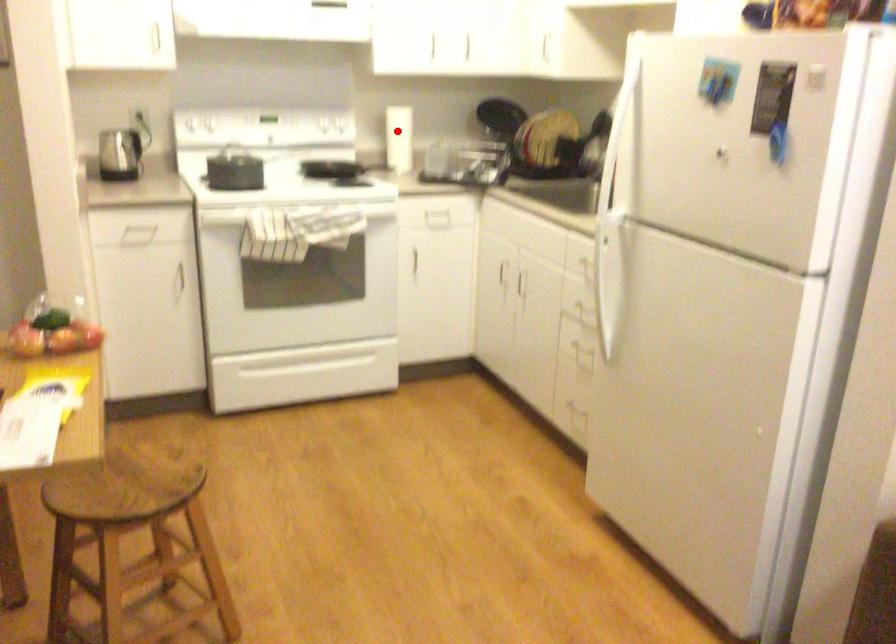
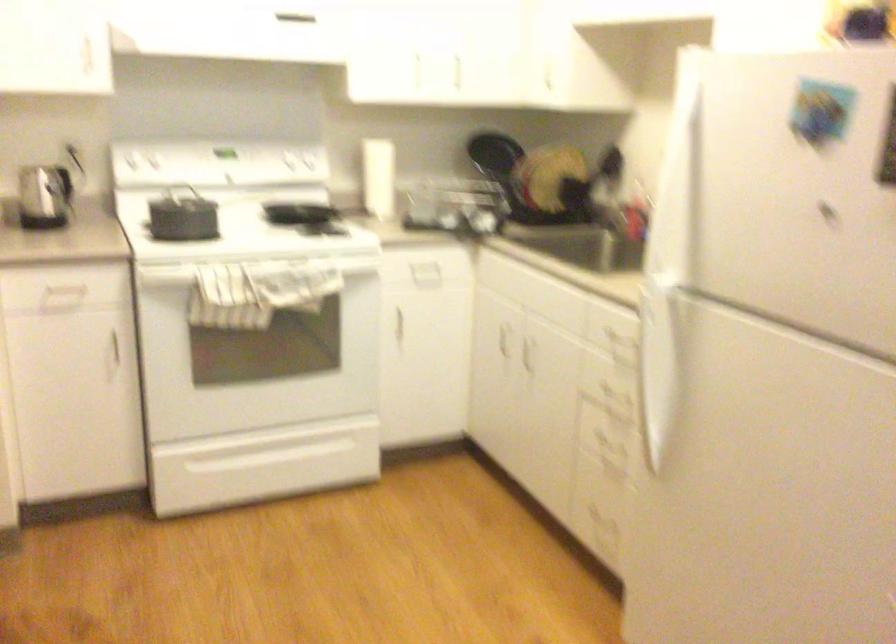
Find the pixel in the second image that matches the highlighted location in the first image.

(377, 178)